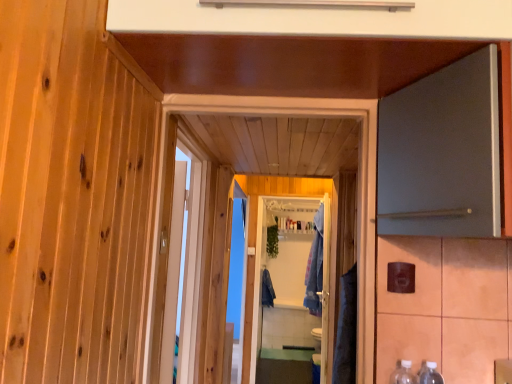
Question: Is white glossy screen door at center shorter than denim robe at center, the second robe in the left-to-right sequence?

Choices:
 (A) no
 (B) yes

Answer: (A)

Question: Is white glossy screen door at center looking in the opposite direction of denim robe at center, the 1th robe viewed from the right?

Choices:
 (A) no
 (B) yes

Answer: (A)

Question: Is white glossy screen door at center touching denim robe at center, which is the 1th robe from front to back?

Choices:
 (A) yes
 (B) no

Answer: (B)

Question: Can you confirm if white glossy screen door at center is thinner than denim robe at center, which is the 1th robe from front to back?

Choices:
 (A) no
 (B) yes

Answer: (B)

Question: From a real-world perspective, does white glossy screen door at center sit lower than denim robe at center, the 1th robe viewed from the right?

Choices:
 (A) yes
 (B) no

Answer: (A)

Question: From the image's perspective, relative to clear plastic bottles at lower right, positioned as the second bottle in left-to-right order, is white wooden door at center, positioned as the 1th door in left-to-right order, above or below?

Choices:
 (A) above
 (B) below

Answer: (A)

Question: From a real-world perspective, is white wooden door at center, positioned as the 1th door in left-to-right order, physically located above or below clear plastic bottles at lower right, which is the first bottle from right to left?

Choices:
 (A) below
 (B) above

Answer: (B)

Question: Considering the positions of point pyautogui.click(x=262, y=104) and point pyautogui.click(x=430, y=369), is point pyautogui.click(x=262, y=104) closer or farther from the camera than point pyautogui.click(x=430, y=369)?

Choices:
 (A) farther
 (B) closer

Answer: (A)

Question: Considering the positions of white wooden door at center, positioned as the 1th door in left-to-right order, and clear plastic bottles at lower right, which is the first bottle from right to left, in the image, is white wooden door at center, positioned as the 1th door in left-to-right order, wider or thinner than clear plastic bottles at lower right, which is the first bottle from right to left,?

Choices:
 (A) wide
 (B) thin

Answer: (B)

Question: In the image, is white wooden door at center, positioned as the 1th door in left-to-right order, positioned in front of or behind clear plastic bottles at lower right, which is counted as the first bottle, starting from the left?

Choices:
 (A) behind
 (B) front

Answer: (A)

Question: From the image's perspective, relative to clear plastic bottles at lower right, arranged as the second bottle when viewed from the right, is white wooden door at center, positioned as the 1th door in left-to-right order, above or below?

Choices:
 (A) above
 (B) below

Answer: (A)

Question: From a real-world perspective, is white wooden door at center, marked as the second door in a right-to-left arrangement, above or below clear plastic bottles at lower right, which is counted as the first bottle, starting from the left?

Choices:
 (A) above
 (B) below

Answer: (A)

Question: Which is correct: white wooden door at center, positioned as the 1th door in left-to-right order, is inside clear plastic bottles at lower right, which is counted as the first bottle, starting from the left, or outside of it?

Choices:
 (A) inside
 (B) outside

Answer: (B)

Question: Choose the correct answer: Is white wooden door at center, positioned as the 1th door in left-to-right order, inside denim robe at center, the 1th robe viewed from the right, or outside it?

Choices:
 (A) inside
 (B) outside

Answer: (B)

Question: Is white wooden door at center, marked as the second door in a right-to-left arrangement, taller or shorter than denim robe at center, which is the 1th robe from front to back?

Choices:
 (A) short
 (B) tall

Answer: (A)